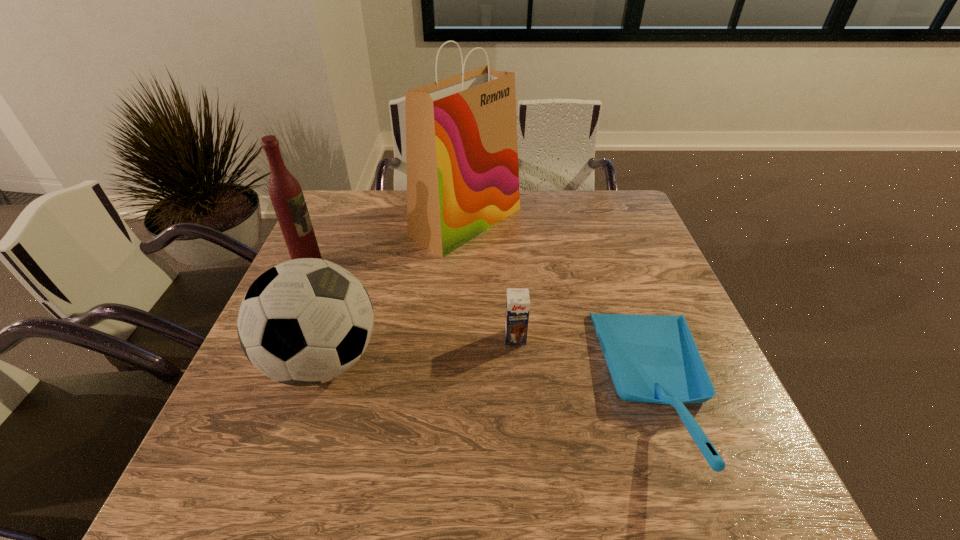
You are a GUI agent. You are given a task and a screenshot of the screen. Output one action in this format:
    pyautogui.click(x=<x>, y=<y>)
    Task: Click on the free space at the left edge of the desktop
    This screenshot has height=540, width=960.
    Given the screenshot: What is the action you would take?
    pyautogui.click(x=345, y=260)

The image size is (960, 540). I want to click on free point at the right edge, so click(647, 302).

At what (x,y) coordinates should I click in order to perform the action: click on vacant space at the far left corner of the desktop. Please return your answer as a coordinate pair (x, y). The width and height of the screenshot is (960, 540). Looking at the image, I should click on (324, 219).

At what (x,y) coordinates should I click in order to perform the action: click on free space at the far right corner. Please return your answer as a coordinate pair (x, y). This screenshot has width=960, height=540. Looking at the image, I should click on (583, 202).

You are a GUI agent. You are given a task and a screenshot of the screen. Output one action in this format:
    pyautogui.click(x=<x>, y=<y>)
    Task: Click on the free space between the chocolate milk and the dustpan
    The height and width of the screenshot is (540, 960).
    Given the screenshot: What is the action you would take?
    (x=588, y=364)

Where is `free point between the chocolate milk and the soccer ball`? The width and height of the screenshot is (960, 540). free point between the chocolate milk and the soccer ball is located at coordinates (420, 349).

This screenshot has width=960, height=540. What are the coordinates of `vacant space that's between the fourth nearest object and the dustpan` in the screenshot? It's located at (486, 329).

Find the location of a particular element. vacant area between the farthest object and the chocolate milk is located at coordinates (491, 280).

Identify the location of free space between the second farthest object and the rightmost object. (486, 329).

Find the location of `free space between the chocolate milk and the tallest object`. free space between the chocolate milk and the tallest object is located at coordinates (491, 280).